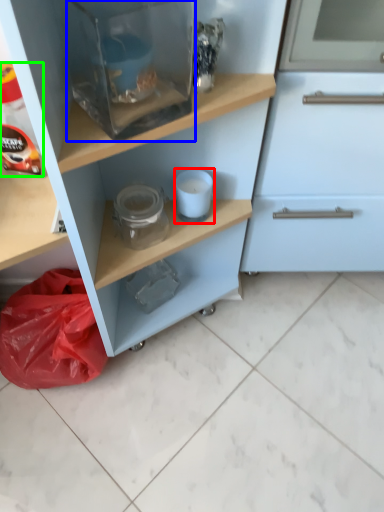
Question: Considering the real-world distances, which object is farthest from appliance (highlighted by a red box)? appliance (highlighted by a blue box) or bottle (highlighted by a green box)?

Choices:
 (A) appliance
 (B) bottle

Answer: (B)